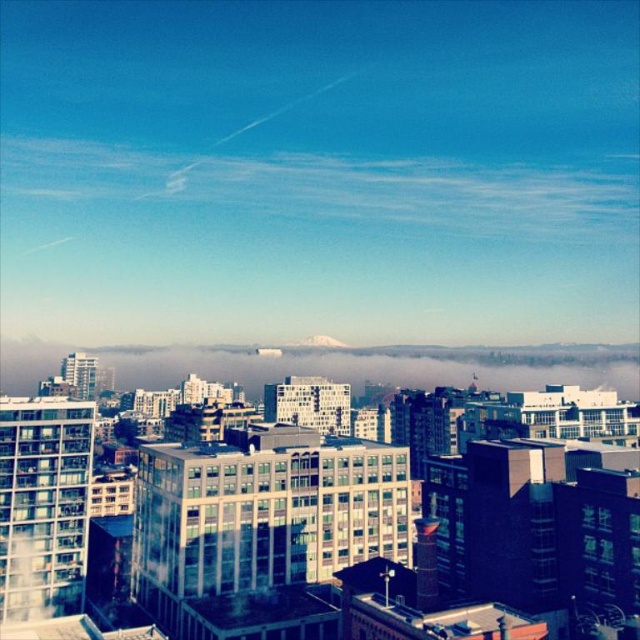
You are standing at the base of the mountain in the image and want to reach a specific point marked at coordinates point (330, 154). Given that you can walk at a speed of 5 meters per minute, how many minutes will it take you to reach that point?

The distance of point (330, 154) from viewer is 539.46 meters. At a walking speed of 5 meters per minute, it would take 539.46 divided by 5, which is approximately 107.89 minutes to reach the point (330, 154).

You are a drone operator planning to fly a drone that has a maximum flight altitude of 500 meters. You want to capture a photo of the white wispy cloud at upper center. Based on the scene description, can your drone safely reach the cloud without exceeding its altitude limit?

The white wispy cloud at upper center is 524.09 meters away from the viewer. Since the drone can only fly up to 500 meters, it cannot safely reach the cloud without exceeding its altitude limit.